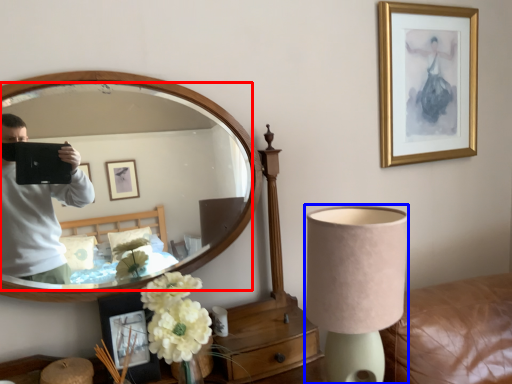
Question: Which of the following is the closest to the observer, mirror (highlighted by a red box) or lamp (highlighted by a blue box)?

Choices:
 (A) mirror
 (B) lamp

Answer: (B)